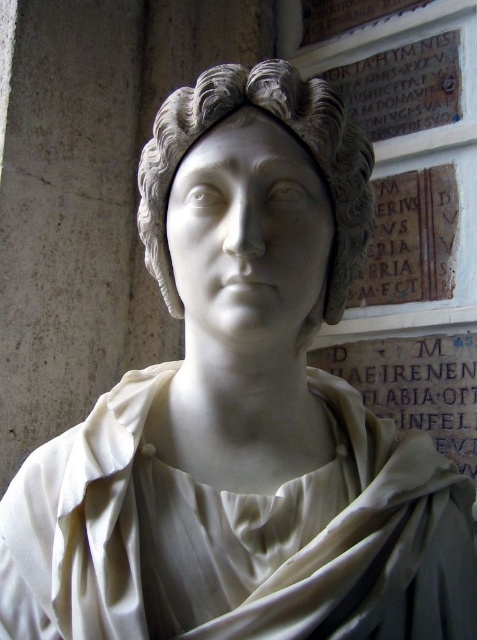
Who is more forward, (x=192, y=140) or (x=382, y=380)?

Positioned in front is point (x=192, y=140).

Which is below, white marble head at center or white marble inscription at lower right?

Positioned lower is white marble inscription at lower right.

At what (x,y) coordinates should I click in order to perform the action: click on white marble head at center. Please return your answer as a coordinate pair (x, y). The height and width of the screenshot is (640, 477). Looking at the image, I should click on (289, 132).

I want to click on white marble head at center, so [289, 132].